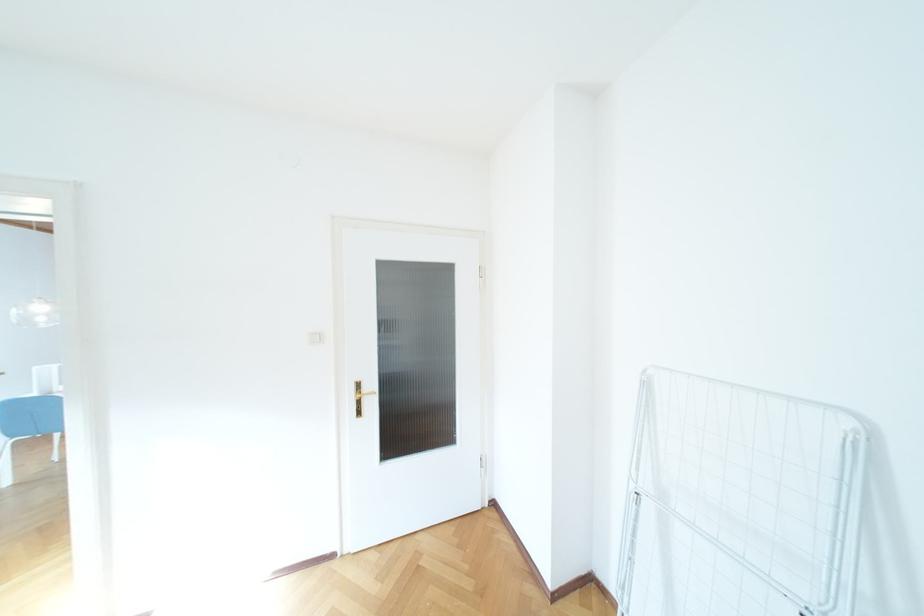
Where would you press the white light switch? Please return your answer as a coordinate pair (x, y).

(313, 338)